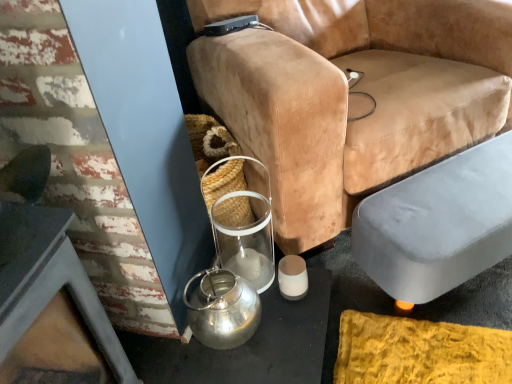
In order to face velvet tan chair at center, should I rotate leftwards or rightwards?

You should look right and rotate roughly 11.887 degrees.

At what (x,y) coordinates should I click in order to perform the action: click on shiny metallic kettle at lower left. Please return your answer as a coordinate pair (x, y). The image size is (512, 384). Looking at the image, I should click on (222, 309).

Describe the element at coordinates (222, 309) in the screenshot. Image resolution: width=512 pixels, height=384 pixels. I see `shiny metallic kettle at lower left` at that location.

Image resolution: width=512 pixels, height=384 pixels. What do you see at coordinates (438, 224) in the screenshot? I see `gray fabric ottoman at lower right` at bounding box center [438, 224].

Where is `matte white candle at lower center`? The image size is (512, 384). matte white candle at lower center is located at coordinates (293, 277).

Is gray fabric ottoman at lower right smaller than shiny metallic kettle at lower left?

No.

Is point (490, 141) closer to camera compared to point (185, 286)?

That is False.

Is gray fabric ottoman at lower right next to shiny metallic kettle at lower left?

No, gray fabric ottoman at lower right is not with shiny metallic kettle at lower left.

Considering the sizes of objects shiny metallic kettle at lower left and velvet tan chair at center in the image provided, who is shorter, shiny metallic kettle at lower left or velvet tan chair at center?

shiny metallic kettle at lower left.

Which is behind, shiny metallic kettle at lower left or velvet tan chair at center?

shiny metallic kettle at lower left is behind.

Which is closer, (251, 301) or (303, 44)?

Point (251, 301).

Which of these two, shiny metallic kettle at lower left or velvet tan chair at center, is bigger?

velvet tan chair at center.

Could velvet tan chair at center be considered to be inside gray fabric ottoman at lower right?

No, gray fabric ottoman at lower right does not contain velvet tan chair at center.

The image size is (512, 384). Find the location of `chair in front of the gray fabric ottoman at lower right`. chair in front of the gray fabric ottoman at lower right is located at coordinates (351, 94).

Is gray fabric ottoman at lower right positioned far away from velvet tan chair at center?

No, gray fabric ottoman at lower right is in close proximity to velvet tan chair at center.

From the image's perspective, which is below, gray fabric ottoman at lower right or velvet tan chair at center?

gray fabric ottoman at lower right.

Which is more to the right, matte white candle at lower center or gray fabric ottoman at lower right?

gray fabric ottoman at lower right is more to the right.

Could you tell me if matte white candle at lower center is facing gray fabric ottoman at lower right?

No, matte white candle at lower center is not facing towards gray fabric ottoman at lower right.

Is matte white candle at lower center thinner than gray fabric ottoman at lower right?

Indeed, matte white candle at lower center has a lesser width compared to gray fabric ottoman at lower right.

From a real-world perspective, between matte white candle at lower center and gray fabric ottoman at lower right, who is vertically lower?

From a 3D spatial view, matte white candle at lower center is below.

From the image's perspective, is shiny metallic kettle at lower left over matte white candle at lower center?

No, from the image's perspective, shiny metallic kettle at lower left is not on top of matte white candle at lower center.

Considering the points (227, 298) and (281, 262), which point is in front, point (227, 298) or point (281, 262)?

The point (227, 298) is in front.

Consider the image. Which object is wider, shiny metallic kettle at lower left or matte white candle at lower center?

shiny metallic kettle at lower left is wider.

From a real-world perspective, is shiny metallic kettle at lower left physically located above or below matte white candle at lower center?

Clearly, from a real-world perspective, shiny metallic kettle at lower left is above matte white candle at lower center.

From the picture: Is matte white candle at lower center aimed at velvet tan chair at center?

No, matte white candle at lower center does not turn towards velvet tan chair at center.

Looking at this image, from a real-world perspective, does matte white candle at lower center sit lower than velvet tan chair at center?

Yes, from a real-world perspective, matte white candle at lower center is beneath velvet tan chair at center.

Considering the relative positions of matte white candle at lower center and velvet tan chair at center in the image provided, is matte white candle at lower center to the left or to the right of velvet tan chair at center?

Clearly, matte white candle at lower center is on the left of velvet tan chair at center in the image.

Which of these two, matte white candle at lower center or velvet tan chair at center, stands shorter?

matte white candle at lower center is shorter.

Consider the image. Considering the relative sizes of velvet tan chair at center and gray fabric ottoman at lower right in the image provided, is velvet tan chair at center wider than gray fabric ottoman at lower right?

Indeed, velvet tan chair at center has a greater width compared to gray fabric ottoman at lower right.

Which is closer, (x=277, y=132) or (x=465, y=268)?

The point (x=277, y=132) is closer to the camera.

Where is `chair that is in front of the gray fabric ottoman at lower right`? The height and width of the screenshot is (384, 512). chair that is in front of the gray fabric ottoman at lower right is located at coordinates (351, 94).

Would you consider velvet tan chair at center to be distant from gray fabric ottoman at lower right?

velvet tan chair at center is actually quite close to gray fabric ottoman at lower right.

Identify the location of swivel chair lying on the right of shiny metallic kettle at lower left. The image size is (512, 384). (438, 224).

Find the location of a particular element. Image resolution: width=512 pixels, height=384 pixels. tea pot that appears below the velvet tan chair at center (from the image's perspective) is located at coordinates pyautogui.click(x=222, y=309).

When comparing their distances from gray fabric ottoman at lower right, does shiny metallic kettle at lower left or velvet tan chair at center seem closer?

velvet tan chair at center.

Based on their spatial positions, is gray fabric ottoman at lower right or velvet tan chair at center further from matte white candle at lower center?

velvet tan chair at center lies further to matte white candle at lower center than the other object.

Based on their spatial positions, is velvet tan chair at center or matte white candle at lower center further from shiny metallic kettle at lower left?

velvet tan chair at center.

From the image, which object appears to be farther from matte white candle at lower center, velvet tan chair at center or gray fabric ottoman at lower right?

Based on the image, velvet tan chair at center appears to be further to matte white candle at lower center.

Looking at the image, which one is located closer to velvet tan chair at center, gray fabric ottoman at lower right or matte white candle at lower center?

Based on the image, gray fabric ottoman at lower right appears to be nearer to velvet tan chair at center.

From the picture: Based on their spatial positions, is gray fabric ottoman at lower right or shiny metallic kettle at lower left closer to velvet tan chair at center?

Based on the image, gray fabric ottoman at lower right appears to be nearer to velvet tan chair at center.

Considering their positions, is matte white candle at lower center positioned closer to velvet tan chair at center than gray fabric ottoman at lower right?

gray fabric ottoman at lower right is closer to velvet tan chair at center.

Looking at this image, which object lies further to the anchor point shiny metallic kettle at lower left, matte white candle at lower center or velvet tan chair at center?

Among the two, velvet tan chair at center is located further to shiny metallic kettle at lower left.

Locate an element on the screen. This screenshot has width=512, height=384. candle holder between velvet tan chair at center and shiny metallic kettle at lower left in the vertical direction is located at coordinates (293, 277).

The image size is (512, 384). Identify the location of swivel chair that lies between velvet tan chair at center and shiny metallic kettle at lower left from top to bottom. (438, 224).

Identify the location of candle holder between shiny metallic kettle at lower left and gray fabric ottoman at lower right. The image size is (512, 384). (293, 277).

Find the location of `swivel chair that lies between velvet tan chair at center and matte white candle at lower center from top to bottom`. swivel chair that lies between velvet tan chair at center and matte white candle at lower center from top to bottom is located at coordinates (438, 224).